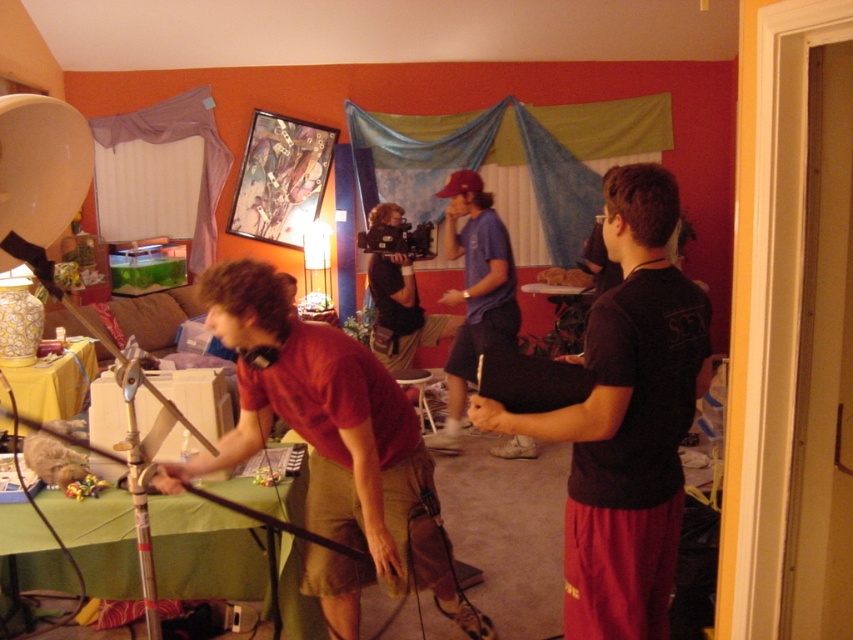
Question: Estimate the real-world distances between objects in this image. Which object is farther from the matte blue shirt at center?

Choices:
 (A) black matte shirt at center
 (B) matte red shirt at center

Answer: (A)

Question: Observing the image, what is the correct spatial positioning of black matte shirt at center in reference to matte blue shirt at center?

Choices:
 (A) below
 (B) above

Answer: (A)

Question: Can you confirm if black matte shirt at center is positioned below matte red shirt at center?

Choices:
 (A) no
 (B) yes

Answer: (A)

Question: Observing the image, what is the correct spatial positioning of black matte shirt at center in reference to matte blue shirt at center?

Choices:
 (A) below
 (B) above

Answer: (A)

Question: Which of these objects is positioned closest to the matte red shirt at center?

Choices:
 (A) black matte shirt at center
 (B) matte blue shirt at center

Answer: (A)

Question: Which of the following is the farthest from the observer?

Choices:
 (A) (438, 436)
 (B) (288, 408)
 (C) (628, 225)

Answer: (A)